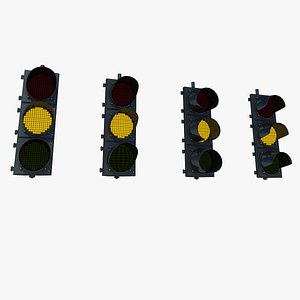
The height and width of the screenshot is (300, 300). Find the location of `light 1`. light 1 is located at coordinates (36, 137).